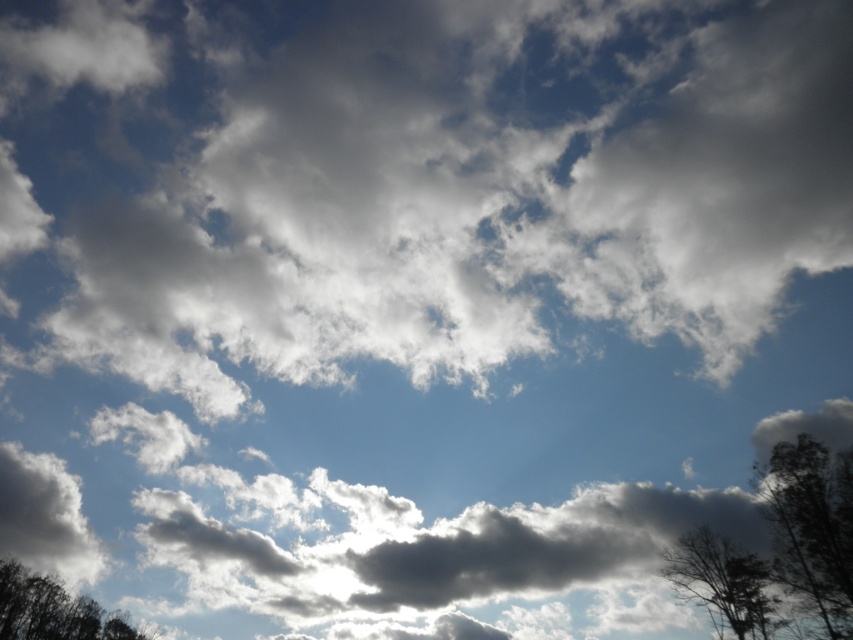
You are a bird looking for a sturdy branch to rest on. Which tree would be better to choose between the dark brown textured tree at lower right and the dark green leafy tree at lower left?

The dark green leafy tree at lower left is thicker than the dark brown textured tree at lower right, so it would provide a sturdier branch to rest on.